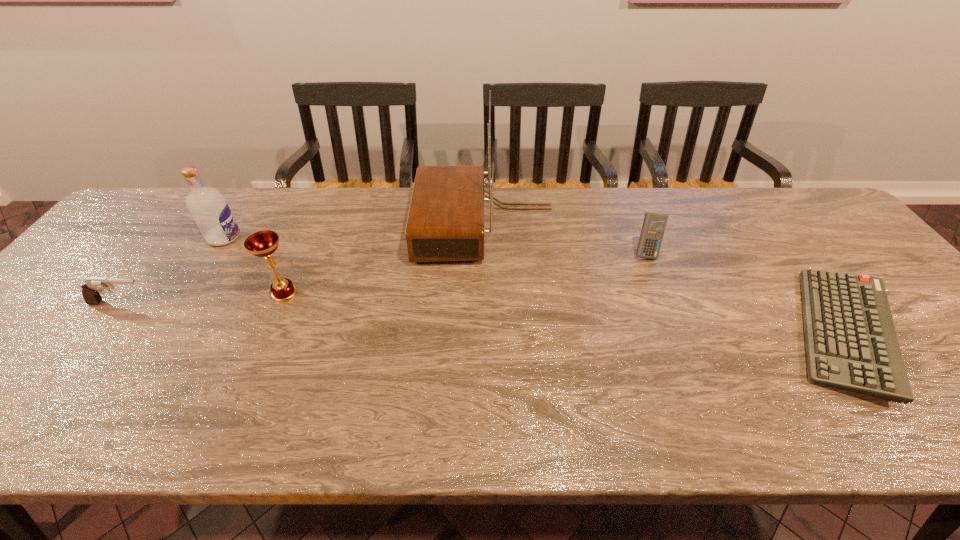
The height and width of the screenshot is (540, 960). What are the coordinates of `free space at the far edge` in the screenshot? It's located at (489, 202).

The width and height of the screenshot is (960, 540). Identify the location of free space at the near edge of the desktop. pyautogui.click(x=134, y=422).

Identify the location of vacant space at the far right corner. (774, 210).

At what (x,y) coordinates should I click in order to perform the action: click on empty space that is in between the second shortest object and the second object from left to right. Please return your answer as a coordinate pair (x, y). The image size is (960, 540). Looking at the image, I should click on (172, 271).

You are a GUI agent. You are given a task and a screenshot of the screen. Output one action in this format:
    pyautogui.click(x=<x>, y=<y>)
    Task: Click on the vacant area between the fifth object from left to right and the fourth shortest object
    
    Given the screenshot: What is the action you would take?
    pyautogui.click(x=466, y=273)

At what (x,y) coordinates should I click in order to perform the action: click on vacant region between the chalice and the leftmost object. Please return your answer as a coordinate pair (x, y). Looking at the image, I should click on (203, 298).

At what (x,y) coordinates should I click in order to perform the action: click on vacant area that lies between the radio_receiver and the vodka. Please return your answer as a coordinate pair (x, y). Looking at the image, I should click on (355, 232).

At what (x,y) coordinates should I click in order to perform the action: click on vacant point located between the fifth object from right to left and the fifth tallest object. Please return your answer as a coordinate pair (x, y). This screenshot has height=540, width=960. Looking at the image, I should click on pos(172,271).

At what (x,y) coordinates should I click in order to perform the action: click on free area in between the calculator and the gun. Please return your answer as a coordinate pair (x, y). Image resolution: width=960 pixels, height=540 pixels. Looking at the image, I should click on click(x=383, y=278).

This screenshot has height=540, width=960. I want to click on free point between the second object from left to right and the gun, so click(x=172, y=271).